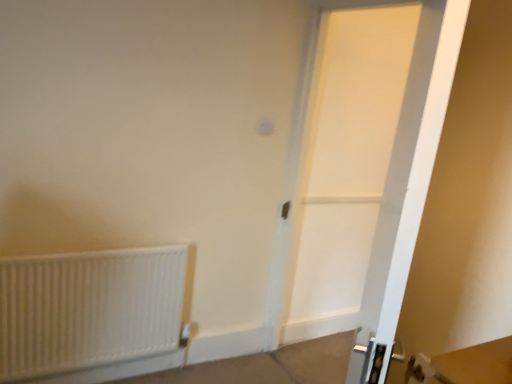
At what (x,y) coordinates should I click in order to perform the action: click on white matte door at center. Please return your answer as a coordinate pair (x, y). The image size is (512, 384). Looking at the image, I should click on (384, 176).

This screenshot has width=512, height=384. What do you see at coordinates (384, 176) in the screenshot?
I see `white matte door at center` at bounding box center [384, 176].

The image size is (512, 384). What do you see at coordinates (88, 309) in the screenshot?
I see `white matte radiator at lower left` at bounding box center [88, 309].

Locate an element on the screen. This screenshot has width=512, height=384. white matte radiator at lower left is located at coordinates (88, 309).

You are a GUI agent. You are given a task and a screenshot of the screen. Output one action in this format:
    pyautogui.click(x=<x>, y=<y>)
    Task: Click on the white matte door at center
    Image resolution: width=512 pixels, height=384 pixels.
    Given the screenshot: What is the action you would take?
    pyautogui.click(x=384, y=176)

Which is more to the right, white matte door at center or white matte radiator at lower left?

From the viewer's perspective, white matte door at center appears more on the right side.

Which object is further away from the camera, white matte door at center or white matte radiator at lower left?

white matte radiator at lower left is further away from the camera.

In the scene shown: Which point is more distant from viewer, (x=406, y=197) or (x=40, y=297)?

The point (x=40, y=297) is farther from the camera.

From the image's perspective, between white matte door at center and white matte radiator at lower left, which one is located above?

white matte door at center.

From the picture: From a real-world perspective, who is located higher, white matte door at center or white matte radiator at lower left?

white matte door at center.

Is white matte door at center thinner than white matte radiator at lower left?

No, white matte door at center is not thinner than white matte radiator at lower left.

Can you confirm if white matte door at center is shorter than white matte radiator at lower left?

In fact, white matte door at center may be taller than white matte radiator at lower left.

Is white matte door at center bigger than white matte radiator at lower left?

Correct, white matte door at center is larger in size than white matte radiator at lower left.

Is white matte door at center located outside white matte radiator at lower left?

Yes, white matte door at center is outside of white matte radiator at lower left.

Is white matte door at center beside white matte radiator at lower left?

They are not placed beside each other.

Based on the photo, could you tell me if white matte door at center is facing white matte radiator at lower left?

Yes, white matte door at center is facing white matte radiator at lower left.

How far apart are white matte door at center and white matte radiator at lower left?

white matte door at center is 1.04 meters from white matte radiator at lower left.

I want to click on door in front of the white matte radiator at lower left, so click(x=384, y=176).

Based on their positions, is white matte radiator at lower left located to the left or right of white matte door at center?

In the image, white matte radiator at lower left appears on the left side of white matte door at center.

Who is more distant, white matte radiator at lower left or white matte door at center?

white matte radiator at lower left is more distant.

Does point (162, 324) come behind point (425, 79)?

Yes, it is.

From the image's perspective, which is above, white matte radiator at lower left or white matte door at center?

white matte door at center.

From a real-world perspective, between white matte radiator at lower left and white matte door at center, who is vertically lower?

white matte radiator at lower left, from a real-world perspective.

Between white matte radiator at lower left and white matte door at center, which one has larger width?

white matte door at center.

Is white matte radiator at lower left taller or shorter than white matte door at center?

In the image, white matte radiator at lower left appears to be shorter than white matte door at center.

Considering the sizes of objects white matte radiator at lower left and white matte door at center in the image provided, who is bigger, white matte radiator at lower left or white matte door at center?

white matte door at center is bigger.

In the scene shown: Choose the correct answer: Is white matte radiator at lower left inside white matte door at center or outside it?

white matte radiator at lower left cannot be found inside white matte door at center.

Based on the photo, would you consider white matte radiator at lower left to be distant from white matte door at center?

white matte radiator at lower left is positioned a significant distance from white matte door at center.

Is white matte radiator at lower left aimed at white matte door at center?

No, white matte radiator at lower left is not oriented towards white matte door at center.

How distant is white matte radiator at lower left from white matte door at center?

white matte radiator at lower left and white matte door at center are 1.04 meters apart.

At what (x,y) coordinates should I click in order to perform the action: click on radiator below the white matte door at center (from the image's perspective). Please return your answer as a coordinate pair (x, y). This screenshot has height=384, width=512. Looking at the image, I should click on (88, 309).

The width and height of the screenshot is (512, 384). I want to click on door in front of the white matte radiator at lower left, so click(384, 176).

The image size is (512, 384). I want to click on radiator below the white matte door at center (from the image's perspective), so click(88, 309).